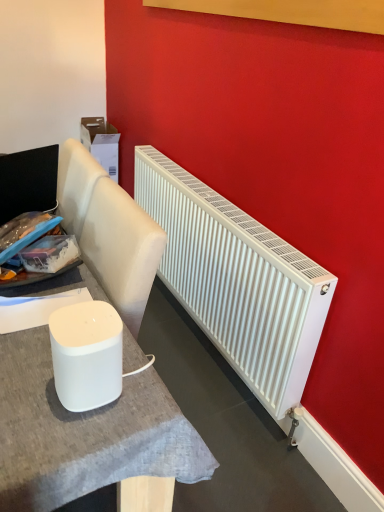
Question: From the image's perspective, is white matte radiator at right above or below white matte table at center?

Choices:
 (A) below
 (B) above

Answer: (B)

Question: Is white matte radiator at right wider or thinner than white matte table at center?

Choices:
 (A) wide
 (B) thin

Answer: (B)

Question: Estimate the real-world distances between objects in this image. Which object is farther from the white matte radiator at right?

Choices:
 (A) white matte speaker at lower left
 (B) white matte table at center

Answer: (A)

Question: Which object is the closest to the white matte table at center?

Choices:
 (A) white matte speaker at lower left
 (B) white matte radiator at right

Answer: (A)